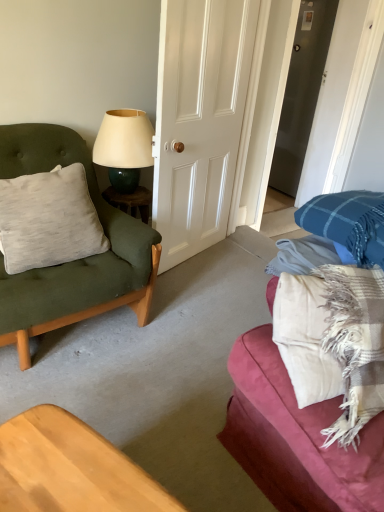
Question: Is plaid fabric couch at right turned away from light gray cotton pillow at left?

Choices:
 (A) no
 (B) yes

Answer: (A)

Question: Does plaid fabric couch at right appear on the left side of light gray cotton pillow at left?

Choices:
 (A) no
 (B) yes

Answer: (A)

Question: Does plaid fabric couch at right appear on the right side of light gray cotton pillow at left?

Choices:
 (A) yes
 (B) no

Answer: (A)

Question: Is plaid fabric couch at right positioned in front of light gray cotton pillow at left?

Choices:
 (A) no
 (B) yes

Answer: (B)

Question: From a real-world perspective, is plaid fabric couch at right on top of light gray cotton pillow at left?

Choices:
 (A) yes
 (B) no

Answer: (A)

Question: In the image, is matte cream lampshade at upper center positioned in front of or behind plaid fabric couch at right?

Choices:
 (A) front
 (B) behind

Answer: (B)

Question: Visually, is matte cream lampshade at upper center positioned to the left or to the right of plaid fabric couch at right?

Choices:
 (A) right
 (B) left

Answer: (B)

Question: Looking at the image, does matte cream lampshade at upper center seem bigger or smaller compared to plaid fabric couch at right?

Choices:
 (A) big
 (B) small

Answer: (B)

Question: Is matte cream lampshade at upper center inside the boundaries of plaid fabric couch at right, or outside?

Choices:
 (A) inside
 (B) outside

Answer: (B)

Question: Which is correct: white glossy door at center is inside matte cream lampshade at upper center, or outside of it?

Choices:
 (A) outside
 (B) inside

Answer: (A)

Question: Looking at their shapes, would you say white glossy door at center is wider or thinner than matte cream lampshade at upper center?

Choices:
 (A) thin
 (B) wide

Answer: (A)

Question: Is white glossy door at center in front of or behind matte cream lampshade at upper center in the image?

Choices:
 (A) front
 (B) behind

Answer: (A)

Question: From a real-world perspective, is white glossy door at center above or below matte cream lampshade at upper center?

Choices:
 (A) above
 (B) below

Answer: (A)

Question: Looking at the image, does matte green cushion at left seem bigger or smaller compared to white glossy door at center?

Choices:
 (A) big
 (B) small

Answer: (B)

Question: Is matte green cushion at left to the left or to the right of white glossy door at center in the image?

Choices:
 (A) left
 (B) right

Answer: (A)